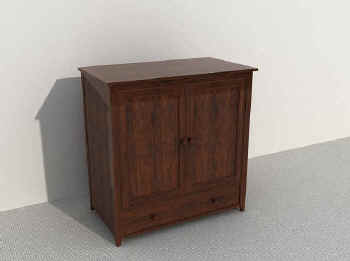
You are a GUI agent. You are given a task and a screenshot of the screen. Output one action in this format:
    pyautogui.click(x=<x>, y=<y>)
    Task: Click on the drawer
    The height and width of the screenshot is (261, 350).
    Given the screenshot: What is the action you would take?
    pyautogui.click(x=184, y=207)